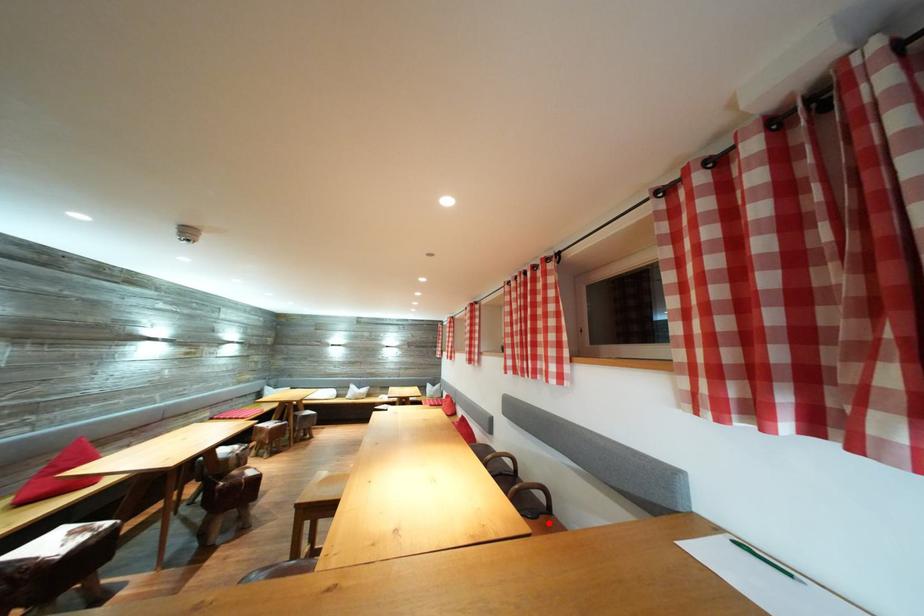
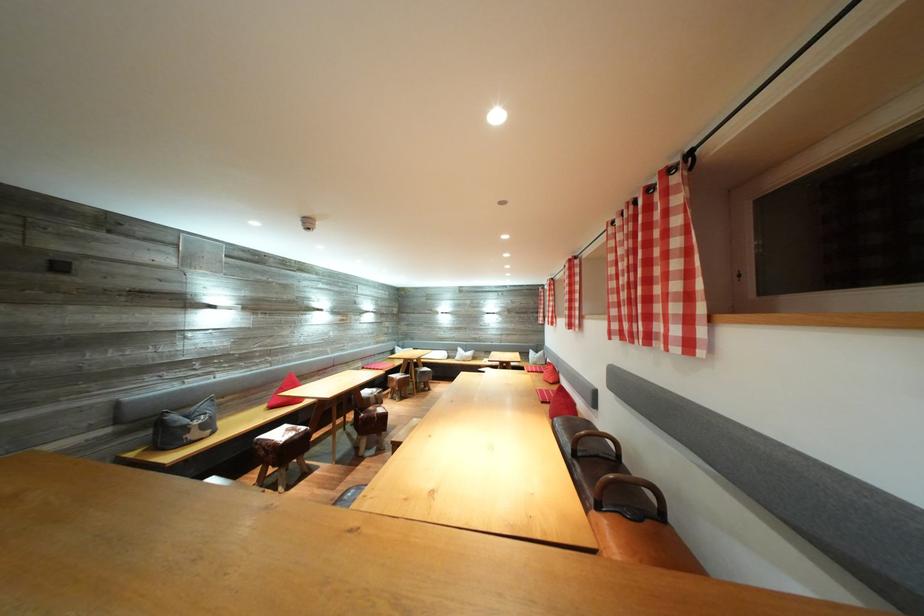
The point at the highlighted location is marked in the first image. Where is the corresponding point in the second image?

(655, 529)